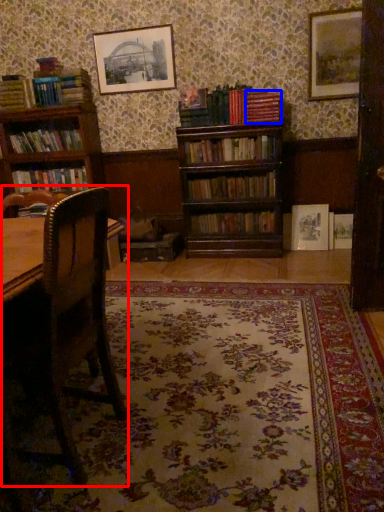
Question: Which point is further to the camera, rocking chair (highlighted by a red box) or book (highlighted by a blue box)?

Choices:
 (A) rocking chair
 (B) book

Answer: (B)